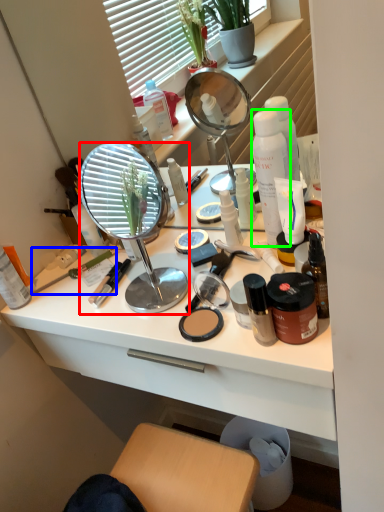
Question: Estimate the real-world distances between objects in this image. Which object is closer to mirror (highlighted by a red box), brush (highlighted by a blue box) or product (highlighted by a green box)?

Choices:
 (A) brush
 (B) product

Answer: (A)